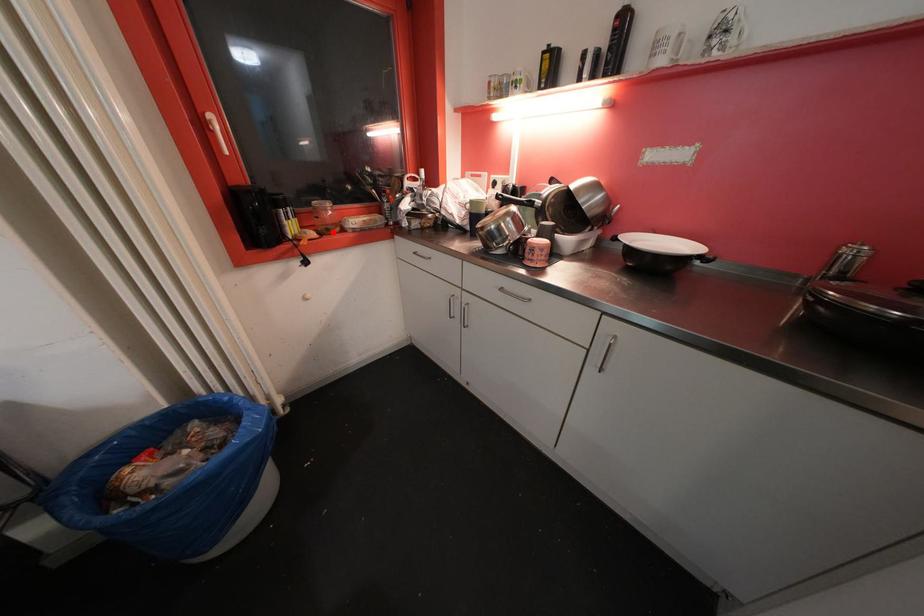
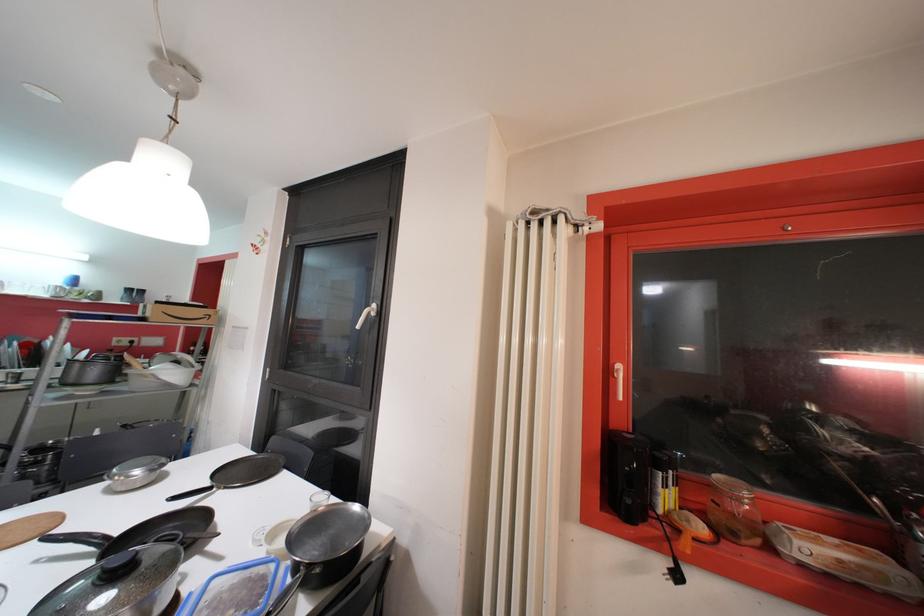
Find the pixel in the second image that matches the highlighted location in the first image.

(738, 536)